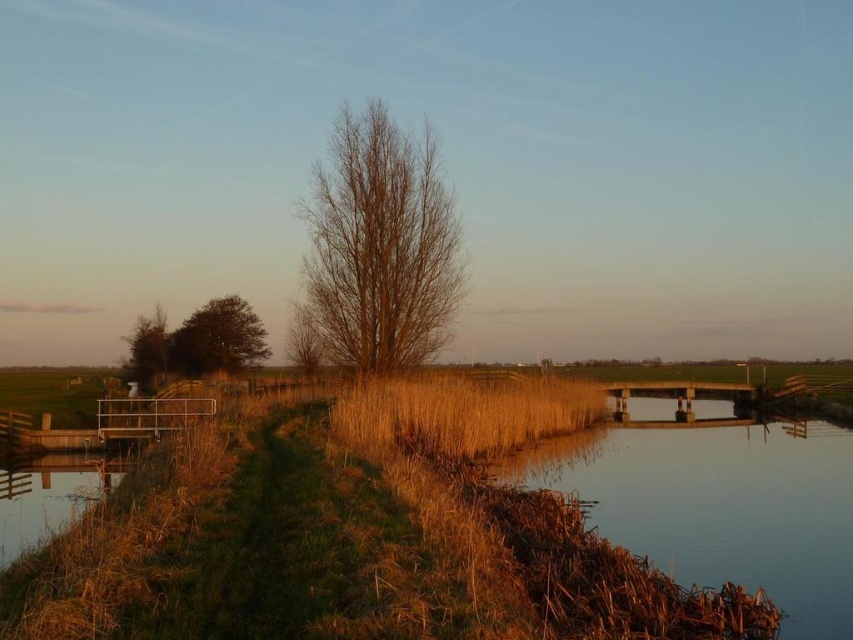
In the scene shown: Is dry grass at center below green matte tree at left?

Yes, dry grass at center is below green matte tree at left.

Can you confirm if dry grass at center is bigger than green matte tree at left?

Correct, dry grass at center is larger in size than green matte tree at left.

Locate an element on the screen. dry grass at center is located at coordinates [x=461, y=413].

This screenshot has height=640, width=853. What do you see at coordinates (717, 500) in the screenshot?
I see `brown grassy river at lower right` at bounding box center [717, 500].

In the scene shown: Does brown grassy river at lower right have a greater height compared to smooth concrete bridge at lower left?

In fact, brown grassy river at lower right may be shorter than smooth concrete bridge at lower left.

Between point (840, 484) and point (44, 540), which one is positioned in front?

Positioned in front is point (44, 540).

At what (x,y) coordinates should I click in order to perform the action: click on brown grassy river at lower right. Please return your answer as a coordinate pair (x, y). Image resolution: width=853 pixels, height=640 pixels. Looking at the image, I should click on (717, 500).

This screenshot has width=853, height=640. In order to click on brown grassy river at lower right in this screenshot , I will do `click(717, 500)`.

Is point (587, 474) positioned after point (247, 314)?

No, it is in front of (247, 314).

You are a GUI agent. You are given a task and a screenshot of the screen. Output one action in this format:
    pyautogui.click(x=<x>, y=<y>)
    Task: Click on the brown grassy river at lower right
    The image size is (853, 640).
    Given the screenshot: What is the action you would take?
    pyautogui.click(x=717, y=500)